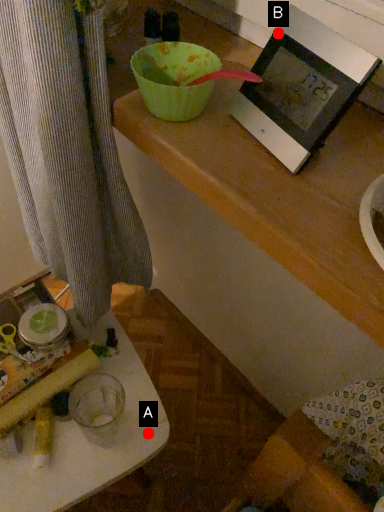
Question: Two points are circled on the image, labeled by A and B beside each circle. Among these points, which one is farthest from the camera?

Choices:
 (A) A is further
 (B) B is further

Answer: (A)